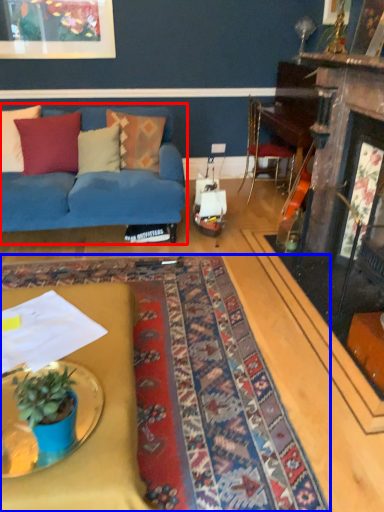
Question: Among these objects, which one is nearest to the camera, studio couch (highlighted by a red box) or mat (highlighted by a blue box)?

Choices:
 (A) studio couch
 (B) mat

Answer: (B)